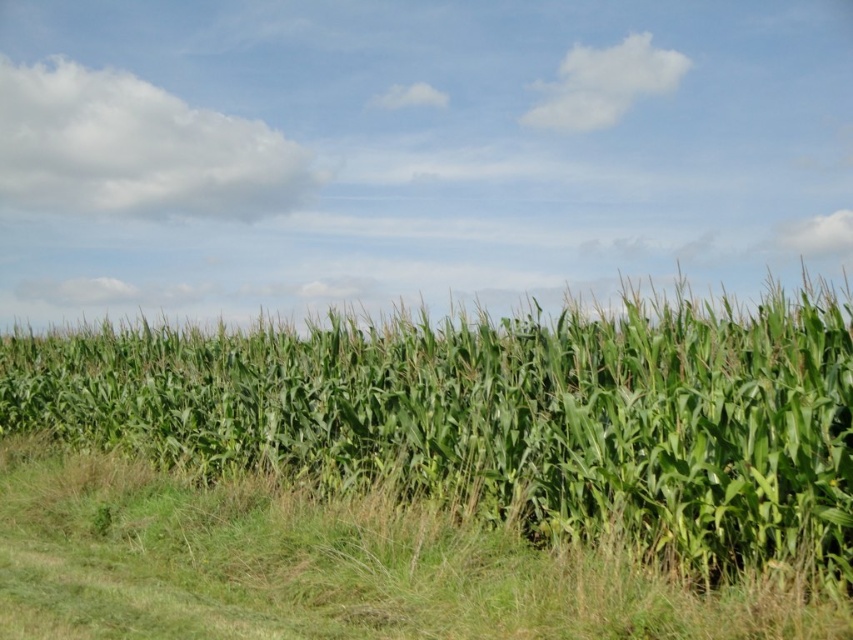
Question: Is green leafy corn at center thinner than green grass at lower center?

Choices:
 (A) yes
 (B) no

Answer: (B)

Question: Which point is farther to the camera?

Choices:
 (A) green leafy corn at center
 (B) green grass at lower center

Answer: (B)

Question: Which point is closer to the camera?

Choices:
 (A) (152, 525)
 (B) (686, 324)

Answer: (A)

Question: Which point is closer to the camera taking this photo?

Choices:
 (A) (53, 531)
 (B) (782, 509)

Answer: (B)

Question: Does green leafy corn at center appear on the right side of green grass at lower center?

Choices:
 (A) yes
 (B) no

Answer: (B)

Question: Can you confirm if green leafy corn at center is positioned to the left of green grass at lower center?

Choices:
 (A) yes
 (B) no

Answer: (A)